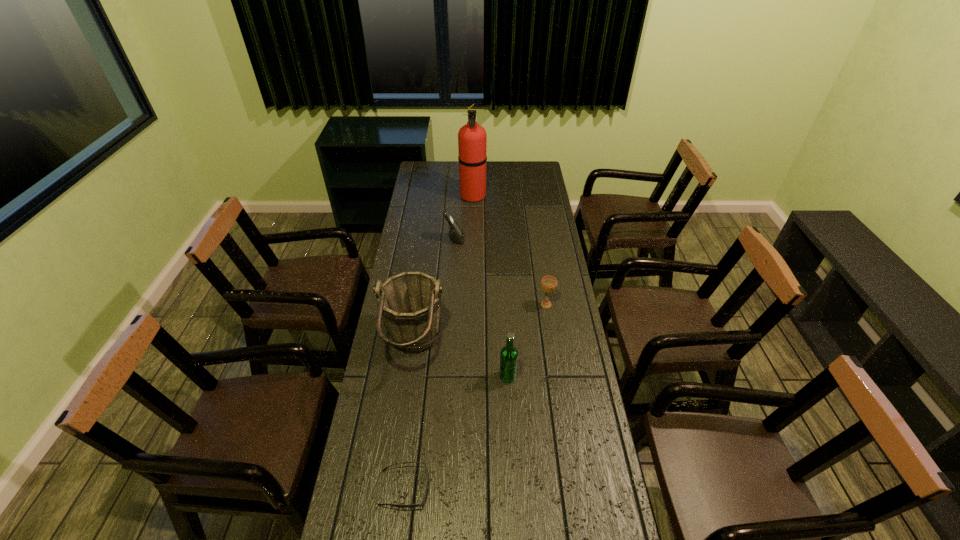
The image size is (960, 540). I want to click on the farthest object, so click(472, 139).

Image resolution: width=960 pixels, height=540 pixels. In order to click on the tallest object in this screenshot , I will do `click(472, 139)`.

Identify the location of bucket. This screenshot has height=540, width=960. (410, 302).

Find the location of a particular element. the second object from right to left is located at coordinates (509, 354).

The height and width of the screenshot is (540, 960). I want to click on beer bottle, so click(x=509, y=354).

Locate an element on the screen. This screenshot has width=960, height=540. the fourth tallest object is located at coordinates (456, 234).

This screenshot has height=540, width=960. What are the coordinates of `the second farthest object` in the screenshot? It's located at (456, 234).

What are the coordinates of `chalice` in the screenshot? It's located at (548, 283).

Locate an element on the screen. the second shortest object is located at coordinates (548, 283).

Identify the location of the nearest object. (421, 504).